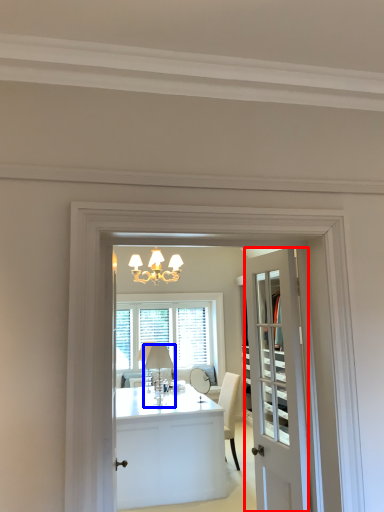
Question: Among these objects, which one is farthest to the camera, door (highlighted by a red box) or lamp (highlighted by a blue box)?

Choices:
 (A) door
 (B) lamp

Answer: (B)